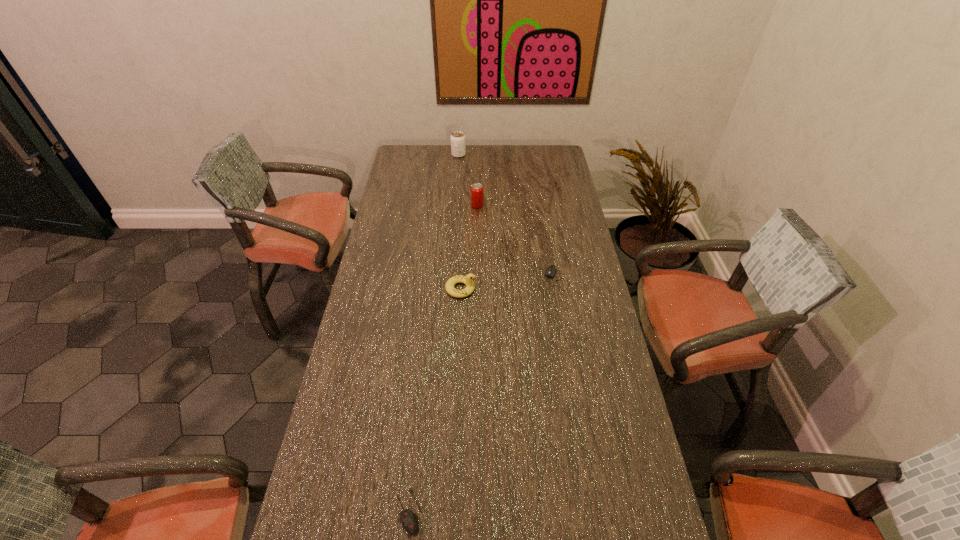
You are a GUI agent. You are given a task and a screenshot of the screen. Output one action in this format:
    pyautogui.click(x=<x>, y=<y>)
    Task: Click on the farthest object
    The image size is (960, 540).
    Given the screenshot: What is the action you would take?
    pyautogui.click(x=458, y=146)

Where is `can`? The width and height of the screenshot is (960, 540). can is located at coordinates (477, 189).

This screenshot has width=960, height=540. I want to click on duckling, so click(467, 280).

You are a GUI agent. You are given a task and a screenshot of the screen. Output one action in this format:
    pyautogui.click(x=<x>, y=<y>)
    Task: Click on the farther mouse
    The height and width of the screenshot is (540, 960).
    Given the screenshot: What is the action you would take?
    (552, 269)

Image resolution: width=960 pixels, height=540 pixels. Find the location of `the right mouse`. the right mouse is located at coordinates click(x=552, y=269).

Locate an element on the screen. the nearer mouse is located at coordinates (409, 519).

Where is `the left mouse`? This screenshot has width=960, height=540. the left mouse is located at coordinates (409, 519).

You are a GUI agent. You are given a task and a screenshot of the screen. Output one action in this format:
    pyautogui.click(x=<x>, y=<y>)
    Task: Click on the vacant space located on the front of the farthest object
    
    Given the screenshot: What is the action you would take?
    pyautogui.click(x=458, y=166)

Find the location of a particular element. The height and width of the screenshot is (540, 960). vacant space situated 0.350m on the front of the can is located at coordinates (477, 264).

Find the location of a particular element. This screenshot has height=540, width=960. vacant space situated on the face of the third shortest object is located at coordinates (527, 289).